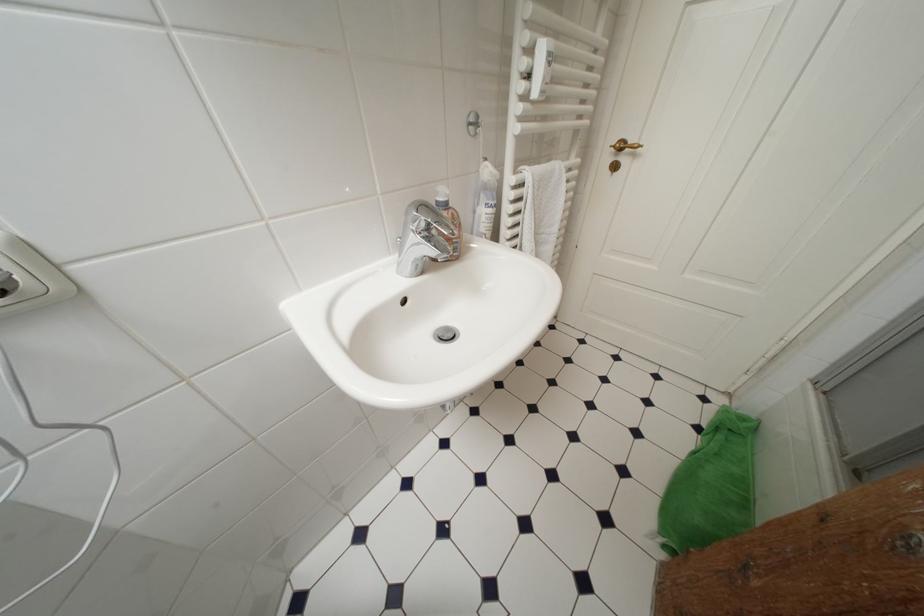
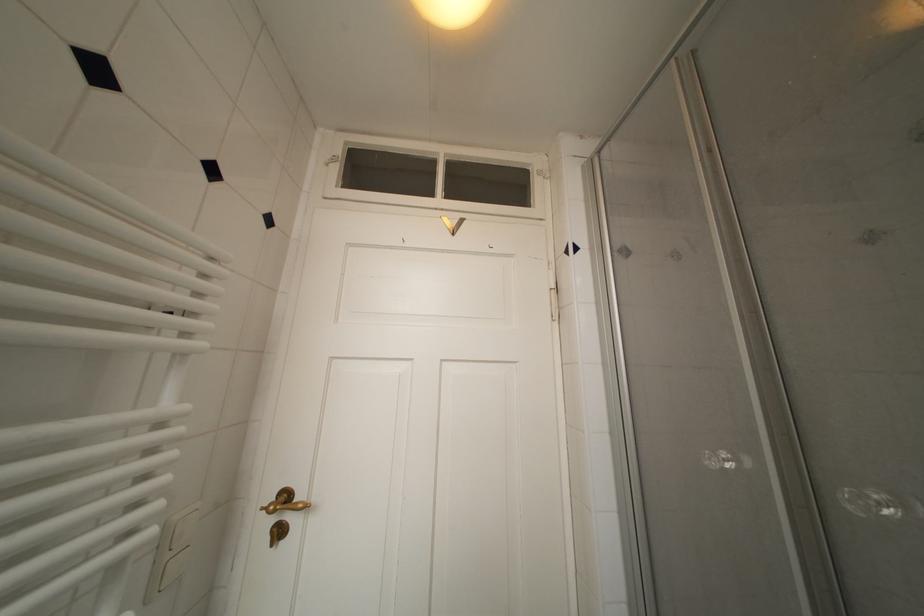
Where in the second image is the point corresponding to the point at 627,148 from the first image?

(293, 500)